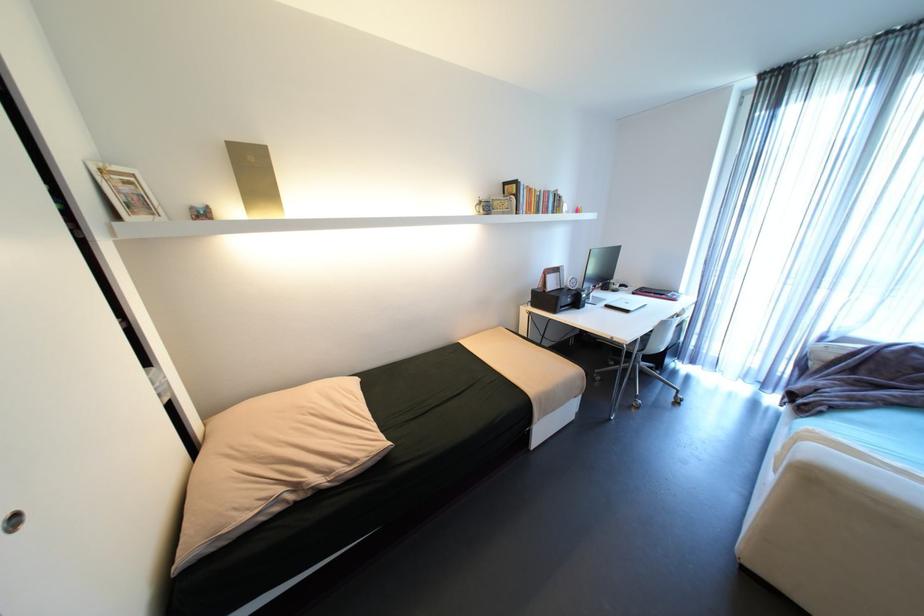
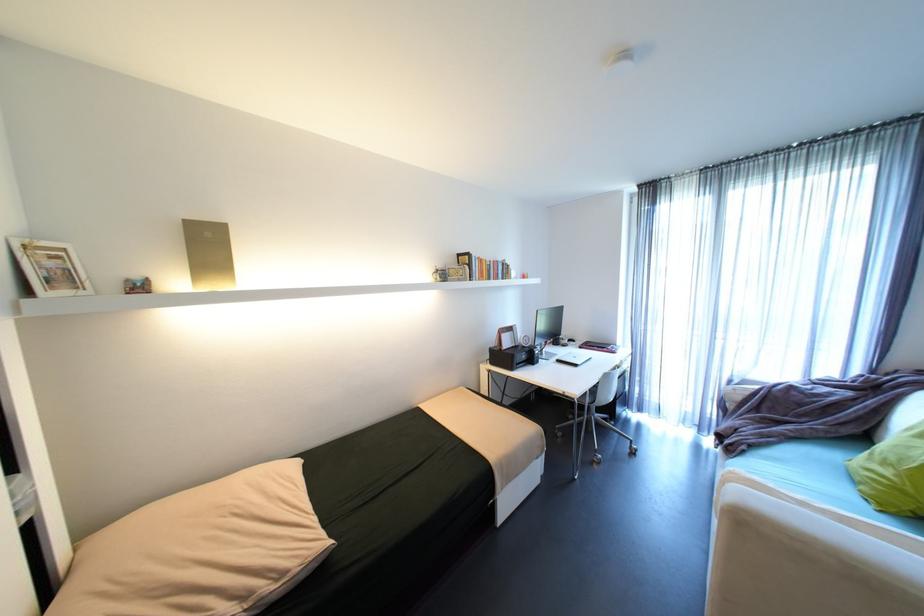
Where in the second image is the point corresponding to point (598, 251) from the first image?

(544, 310)